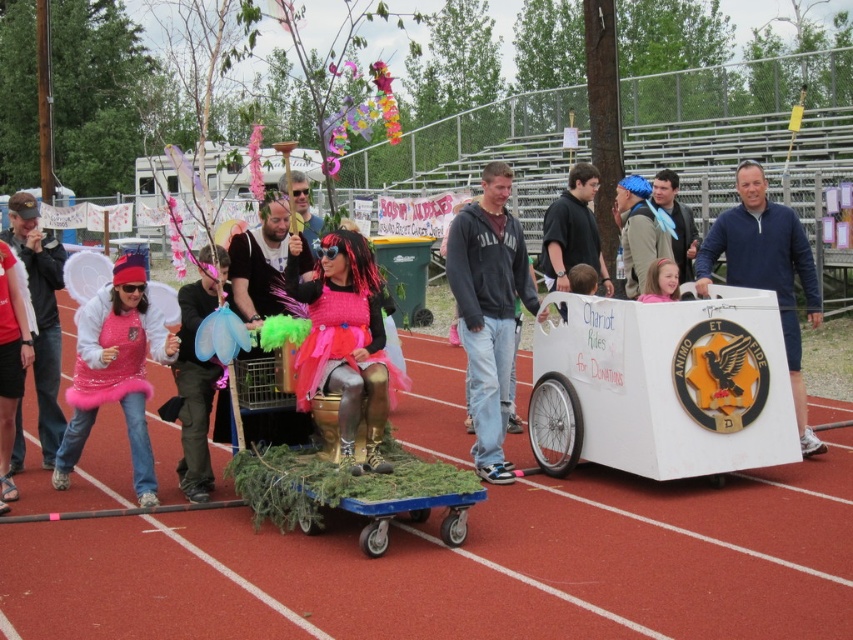
You are standing at the starting line of the red running track and see two points marked on the track. The first point is at coordinate point (x=247, y=524) and the second is at point (x=656, y=230). Which point is closer to you?

Point (x=247, y=524) is in front of point (x=656, y=230), so it is closer to you.

You are standing at the edge of the red running track and see two points in the scene. The first point is at coordinate point (140, 470) and the second is at coordinate point (766, 230). Which point is closer to you?

Point (140, 470) is closer to you than point (766, 230).

You are a photographer at the event and want to capture both the pink feather vest at left and the blue fleece jacket at right in a single frame. Which clothing item will appear smaller in the photo?

The pink feather vest at left will appear smaller in the photo because it has a lesser height compared to the blue fleece jacket at right.